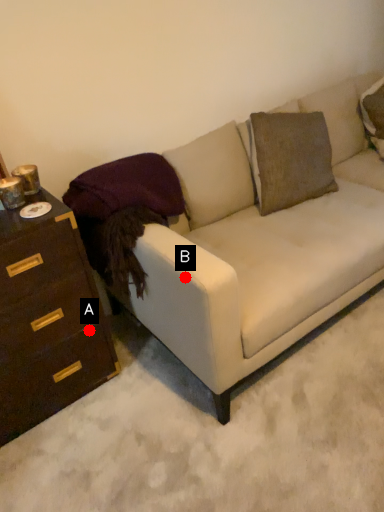
Question: Two points are circled on the image, labeled by A and B beside each circle. Among these points, which one is nearest to the camera?

Choices:
 (A) A is closer
 (B) B is closer

Answer: (B)